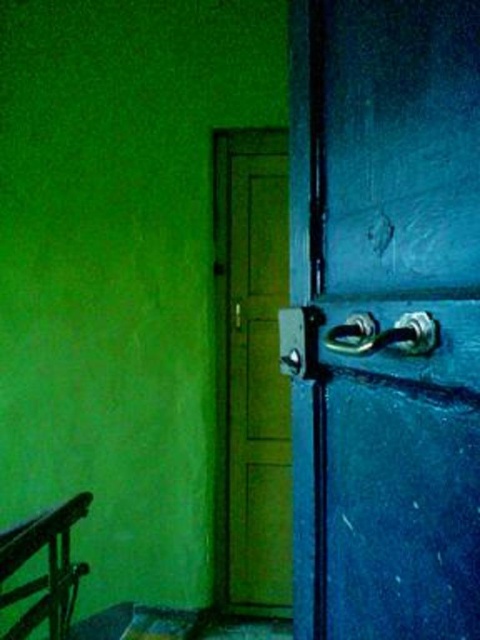
Question: Is green matte door at center in front of polished metal door handle at center?

Choices:
 (A) yes
 (B) no

Answer: (B)

Question: Which point appears closest to the camera in this image?

Choices:
 (A) (392, 342)
 (B) (216, 234)
 (C) (398, 531)

Answer: (A)

Question: Which is nearer to the green matte door at center?

Choices:
 (A) brushed metal balustrade at lower left
 (B) blue matte door handle at center
 (C) polished metal door handle at center

Answer: (A)

Question: Does blue matte door handle at center appear under green matte door at center?

Choices:
 (A) no
 (B) yes

Answer: (A)

Question: Which object is positioned farthest from the green matte door at center?

Choices:
 (A) polished metal door handle at center
 (B) blue matte door handle at center

Answer: (A)

Question: Is green matte door at center bigger than polished metal door handle at center?

Choices:
 (A) no
 (B) yes

Answer: (B)